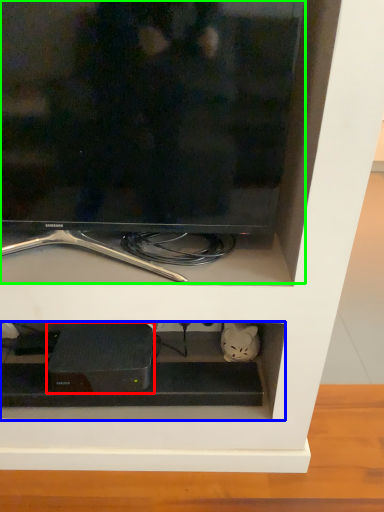
Question: Based on their relative distances, which object is farther from appliance (highlighted by a red box)? Choose from cabinet (highlighted by a blue box) and television (highlighted by a green box).

Choices:
 (A) cabinet
 (B) television

Answer: (B)